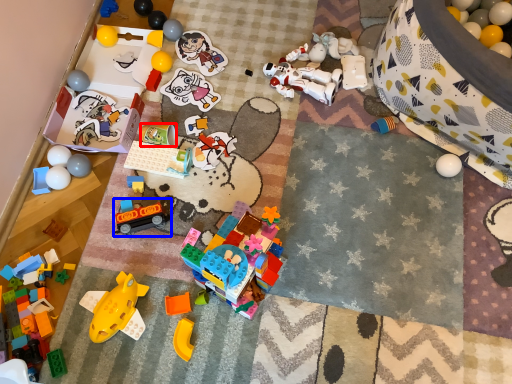
Question: Which of the following is the closest to the observer, toy (highlighted by a red box) or toy (highlighted by a blue box)?

Choices:
 (A) toy
 (B) toy

Answer: (B)